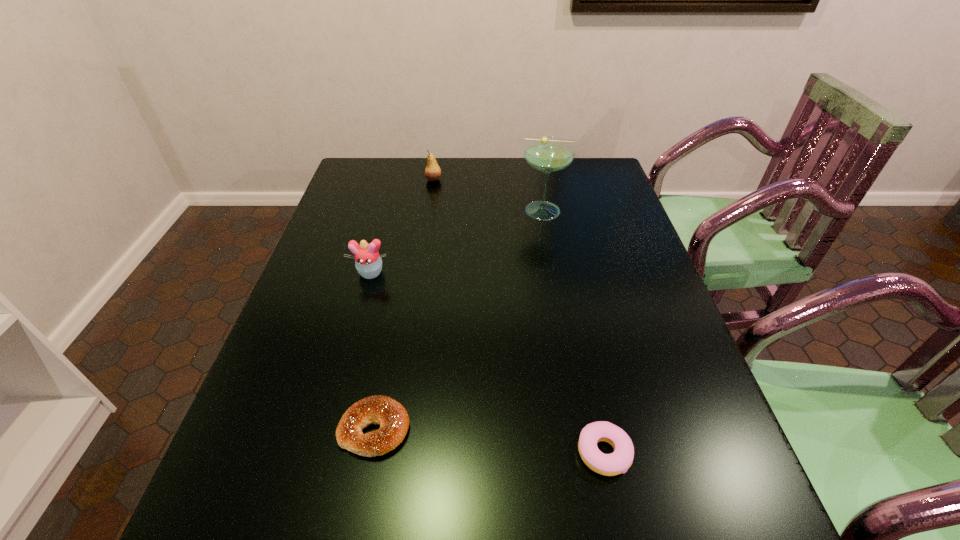
Find the location of a particular element. This screenshot has height=540, width=960. vacant point located on the right of the doughnut is located at coordinates [x=706, y=453].

Where is `object that is at the far edge`? object that is at the far edge is located at coordinates (432, 172).

Image resolution: width=960 pixels, height=540 pixels. What are the coordinates of `object at the left edge` in the screenshot? It's located at (368, 262).

You are a GUI agent. You are given a task and a screenshot of the screen. Output one action in this format:
    pyautogui.click(x=<x>, y=<y>)
    Task: Click on the free space at the far edge
    The image size is (960, 540).
    Given the screenshot: What is the action you would take?
    pyautogui.click(x=507, y=175)

Locate an element on the screen. free space at the left edge of the desktop is located at coordinates (315, 333).

This screenshot has height=540, width=960. In the image, there is a desktop. Identify the location of vacant space at the right edge. (621, 265).

Find the location of `free space at the near right corner of the desktop`. free space at the near right corner of the desktop is located at coordinates (740, 515).

Locate an element on the screen. This screenshot has height=540, width=960. empty location between the doughnut and the farthest object is located at coordinates [518, 316].

Find the location of a particular element. The height and width of the screenshot is (540, 960). vacant area that lies between the bagel and the doughnut is located at coordinates (489, 441).

The width and height of the screenshot is (960, 540). In order to click on empty space between the pear and the bagel in this screenshot , I will do `click(404, 304)`.